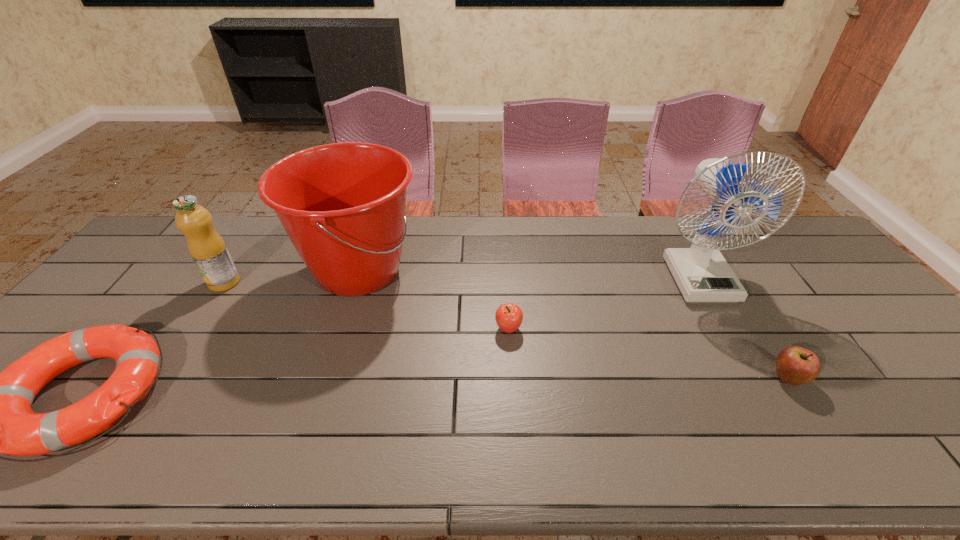
Where is `free region located on the right of the nearer apple`? free region located on the right of the nearer apple is located at coordinates [880, 379].

The height and width of the screenshot is (540, 960). Identify the location of free space located on the left of the farther apple. (375, 329).

What are the coordinates of `fan that is positioned at the far edge` in the screenshot? It's located at (702, 274).

You are a GUI agent. You are given a task and a screenshot of the screen. Output one action in this format:
    pyautogui.click(x=<x>, y=<y>)
    Task: Click on the bucket at the far edge
    This screenshot has width=960, height=540.
    Given the screenshot: What is the action you would take?
    pyautogui.click(x=342, y=205)

Where is `vacant space at the far edge of the desktop`? vacant space at the far edge of the desktop is located at coordinates (668, 246).

In the image, there is a desktop. Identify the location of vacant space at the near edge. (459, 436).

The image size is (960, 540). In order to click on free space at the near left corner of the desktop in this screenshot , I will do `click(4, 456)`.

You are a GUI agent. You are given a task and a screenshot of the screen. Output one action in this format:
    pyautogui.click(x=<x>, y=<y>)
    Task: Click on the vacant space at the far right corner of the desktop
    
    Given the screenshot: What is the action you would take?
    pyautogui.click(x=762, y=243)

Identify the location of empty space that is in between the fourth shortest object and the shorter apple. (367, 306).

I want to click on vacant region between the bucket and the third tallest object, so click(292, 276).